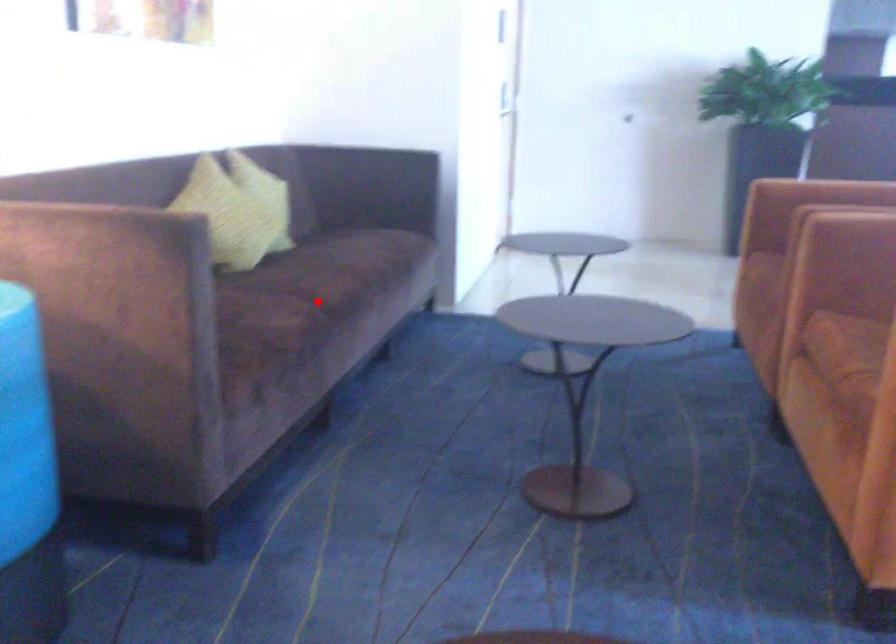
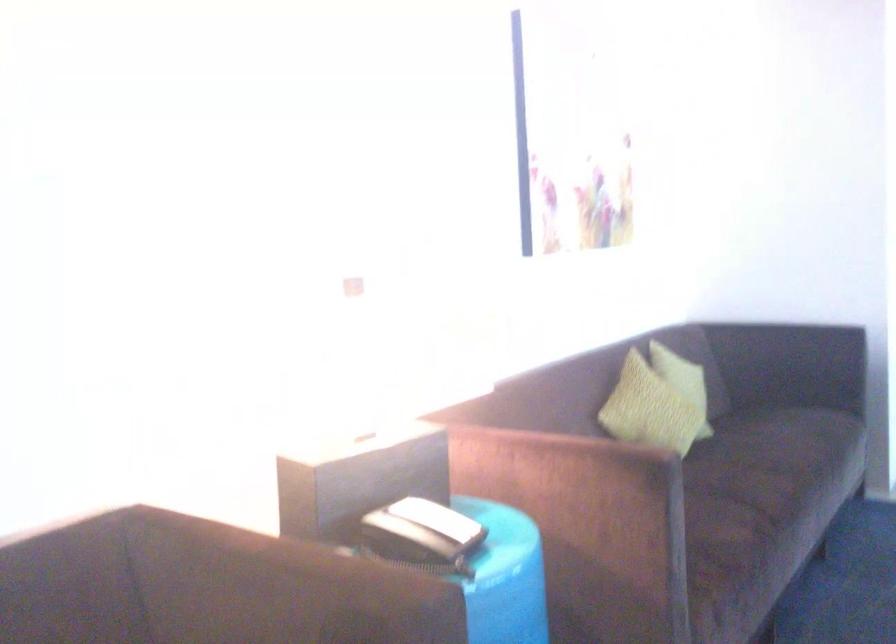
Locate, in the second image, the point that corresponds to the highlighted location in the first image.

(768, 489)